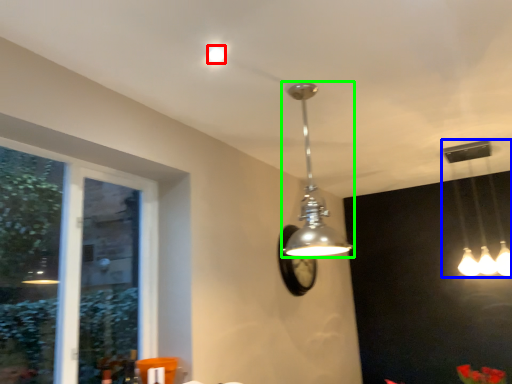
Question: Which object is positioned closest to droplight (highlighted by a red box)? Select from lamp (highlighted by a blue box) and lamp (highlighted by a green box).

Choices:
 (A) lamp
 (B) lamp

Answer: (B)